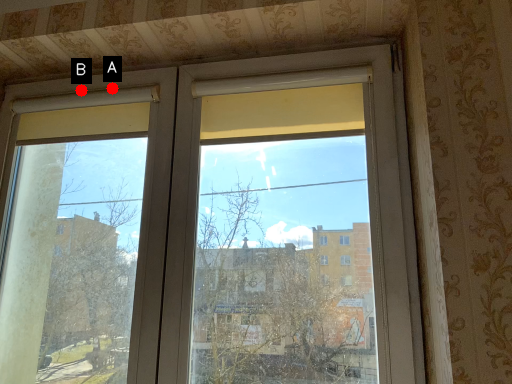
Question: Two points are circled on the image, labeled by A and B beside each circle. Among these points, which one is nearest to the camera?

Choices:
 (A) A is closer
 (B) B is closer

Answer: (A)